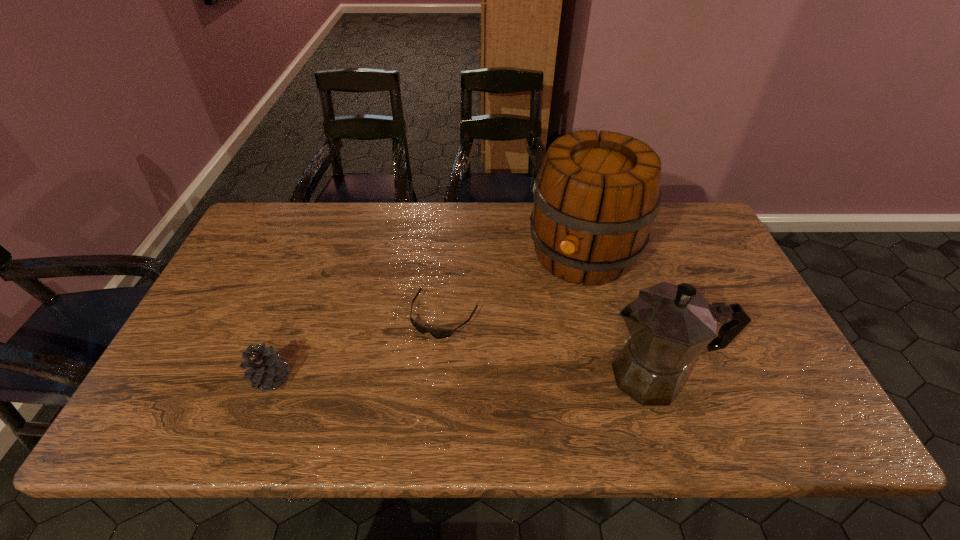
Find the location of a particular element. vacant area that lies between the coffeepot and the leftmost object is located at coordinates (463, 377).

The width and height of the screenshot is (960, 540). I want to click on free area in between the cider and the third object from right to left, so click(x=514, y=285).

Locate an element on the screen. free space between the leftmost object and the coffeepot is located at coordinates (463, 377).

In order to click on vacant space that is in between the pinecone and the coffeepot in this screenshot , I will do `click(463, 377)`.

Locate an element on the screen. free space between the shortest object and the pinecone is located at coordinates (358, 347).

Choose which object is the second nearest neighbor to the leftmost object. Please provide its 2D coordinates. Your answer should be formatted as a tuple, i.e. [(x, y)], where the tuple contains the x and y coordinates of a point satisfying the conditions above.

[(595, 198)]

Identify which object is the nearest to the second shortest object. Please provide its 2D coordinates. Your answer should be formatted as a tuple, i.e. [(x, y)], where the tuple contains the x and y coordinates of a point satisfying the conditions above.

[(437, 334)]

Locate an element on the screen. Image resolution: width=960 pixels, height=540 pixels. free space that satisfies the following two spatial constraints: 1. on the front side of the cider; 2. on the pouring side of the coffeepot is located at coordinates (613, 376).

Find the location of a particular element. The image size is (960, 540). free space that satisfies the following two spatial constraints: 1. on the front side of the third object from right to left; 2. on the pouring side of the coffeepot is located at coordinates (441, 376).

The image size is (960, 540). I want to click on vacant space that satisfies the following two spatial constraints: 1. on the back side of the second shortest object; 2. on the pouring side of the coffeepot, so click(273, 376).